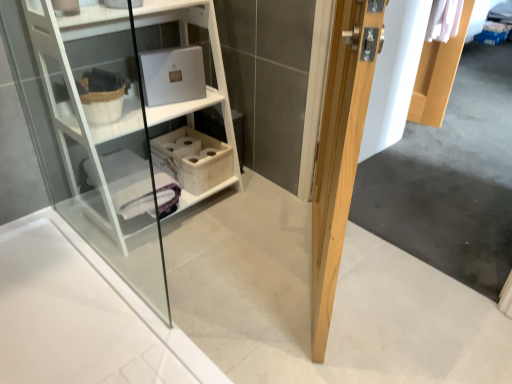
Question: Can you confirm if white woven basket at center is thinner than natural wood door at right?

Choices:
 (A) yes
 (B) no

Answer: (B)

Question: Is white woven basket at center oriented towards natural wood door at right?

Choices:
 (A) yes
 (B) no

Answer: (A)

Question: From a real-world perspective, does white woven basket at center stand above natural wood door at right?

Choices:
 (A) no
 (B) yes

Answer: (A)

Question: Would you say white woven basket at center is a long distance from natural wood door at right?

Choices:
 (A) no
 (B) yes

Answer: (A)

Question: From the image's perspective, is white woven basket at center beneath natural wood door at right?

Choices:
 (A) no
 (B) yes

Answer: (A)

Question: Is white woven basket at center bigger or smaller than natural wood door at right?

Choices:
 (A) small
 (B) big

Answer: (A)

Question: From a real-world perspective, relative to natural wood door at right, is white woven basket at center vertically above or below?

Choices:
 (A) below
 (B) above

Answer: (A)

Question: Is point (162, 147) closer or farther from the camera than point (354, 79)?

Choices:
 (A) farther
 (B) closer

Answer: (A)

Question: Considering their positions, is white woven basket at center located in front of or behind natural wood door at right?

Choices:
 (A) behind
 (B) front

Answer: (A)

Question: Do you think natural wood door at right is within white woven basket at center, or outside of it?

Choices:
 (A) outside
 (B) inside

Answer: (A)

Question: From a real-world perspective, relative to white woven basket at center, is natural wood door at right vertically above or below?

Choices:
 (A) below
 (B) above

Answer: (B)

Question: From the image's perspective, relative to white woven basket at center, is natural wood door at right above or below?

Choices:
 (A) above
 (B) below

Answer: (B)

Question: Is point (342, 223) closer or farther from the camera than point (190, 175)?

Choices:
 (A) closer
 (B) farther

Answer: (A)

Question: Is natural wood door at right to the left or to the right of white wood shelf at upper left in the image?

Choices:
 (A) right
 (B) left

Answer: (A)

Question: Choose the correct answer: Is natural wood door at right inside white wood shelf at upper left or outside it?

Choices:
 (A) inside
 (B) outside

Answer: (B)